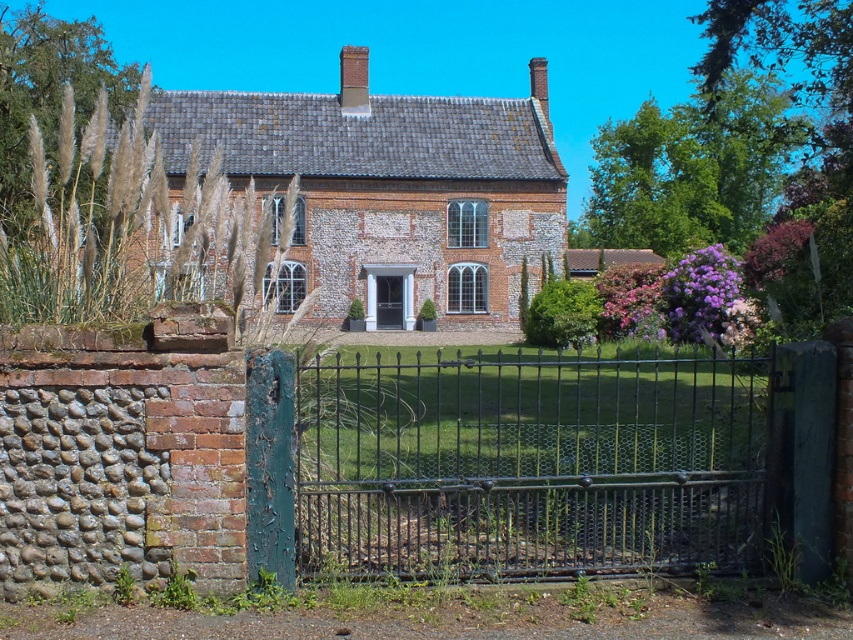
You are a delivery person arriving at the house and need to enter. The black wrought iron gate at center and the black glass door at center are both in front of you. Which one should you pass through to enter the house?

The black wrought iron gate at center is bigger than the black glass door at center, so you should pass through the black glass door at center to enter the house since gates are typically for vehicles and doors for pedestrians, but since the question is about size, the smaller door is more appropriate for entry.

You are standing in front of the house and want to take a photo. There are two points marked in the scene, point 1 at coordinates point (743, 541) and point 2 at coordinates point (378, 307). Which point is closer to your current position?

Point (743, 541) is closer to the camera than point (378, 307), so the point closer to your current position is point (743, 541).

Based on the photo, you are standing in front of the house and want to enter through the black glass door at center. There is a black wrought iron gate at center blocking your path. Can you walk through the gate to reach the door?

The black wrought iron gate at center is 30.19 meters away from the black glass door at center, so yes, you can walk through the gate to reach the door since they are positioned along the same path.